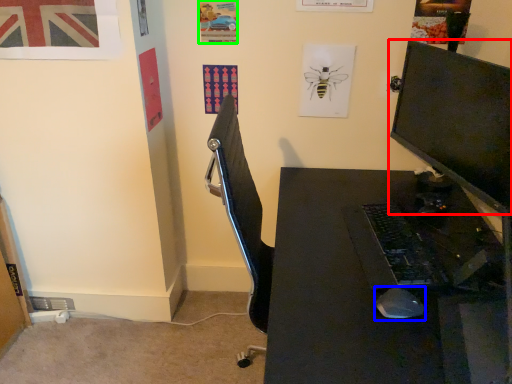
Question: Which object is positioned closest to computer monitor (highlighted by a red box)? Select from mouse (highlighted by a blue box) and poster page (highlighted by a green box).

Choices:
 (A) mouse
 (B) poster page

Answer: (A)